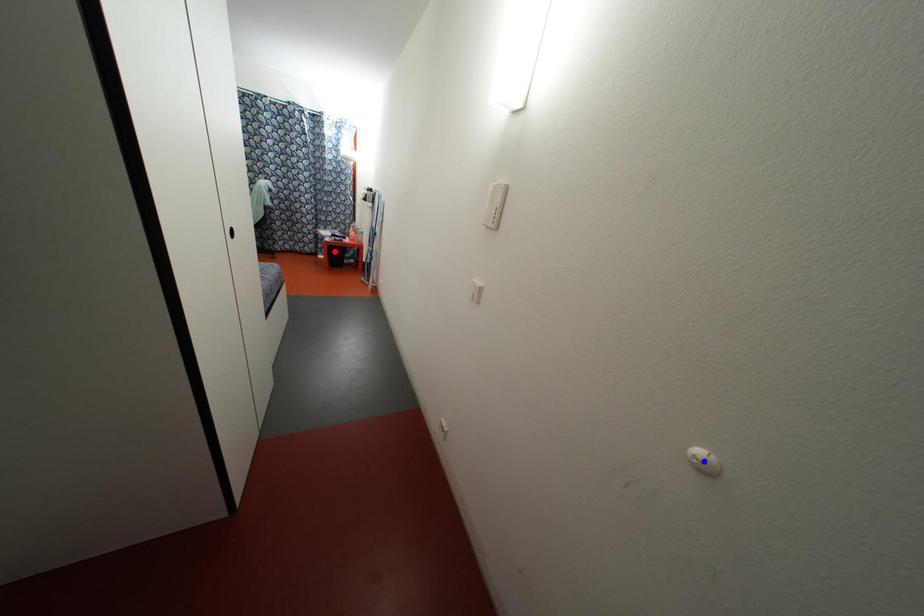
Question: In the image, two points are highlighted. Which point is nearer to the camera? Reply with the corresponding letter.

Choices:
 (A) blue point
 (B) red point

Answer: (A)